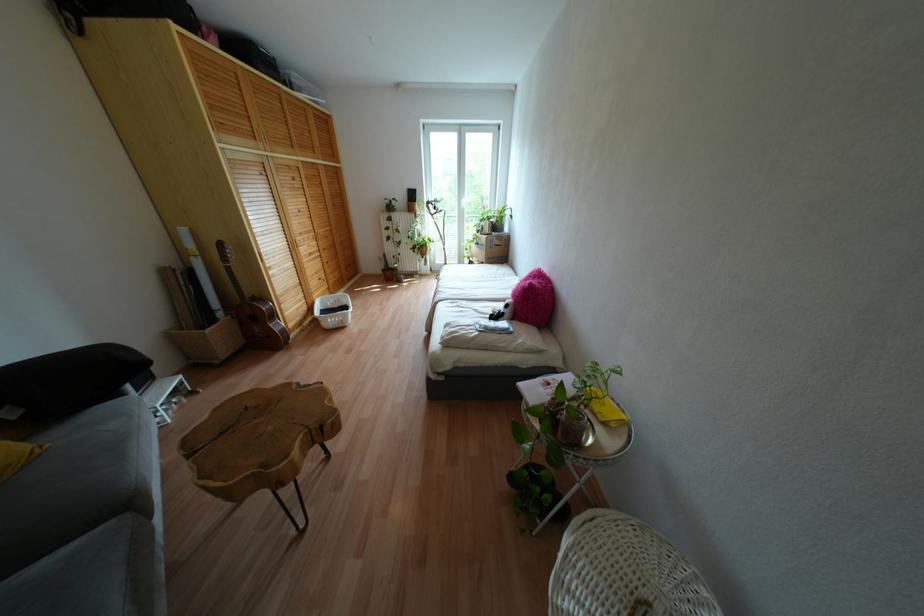
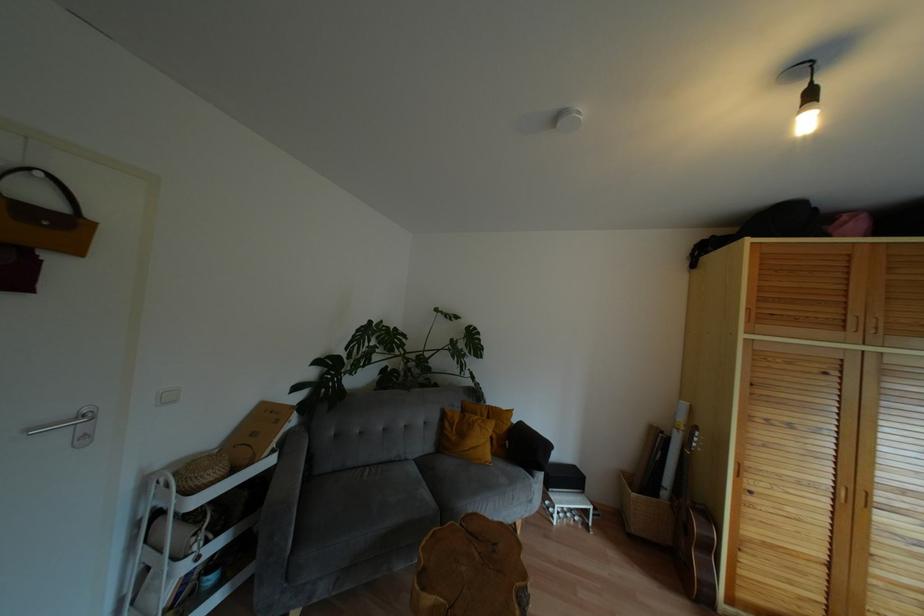
Question: The images are taken continuously from a first-person perspective. In which direction is your viewpoint rotating?

Choices:
 (A) Left
 (B) Right
 (C) Up
 (D) Down

Answer: (A)